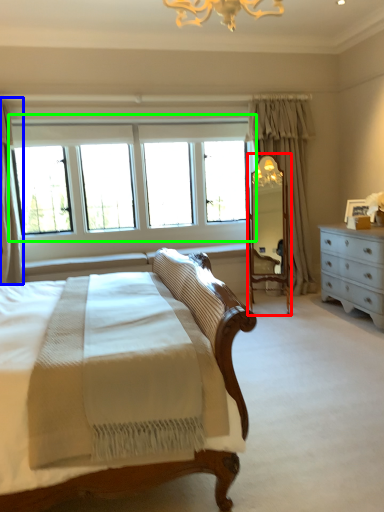
Question: Which object is the closest to the mirror (highlighted by a red box)? Choose among these: curtain (highlighted by a blue box) or window (highlighted by a green box).

Choices:
 (A) curtain
 (B) window

Answer: (B)